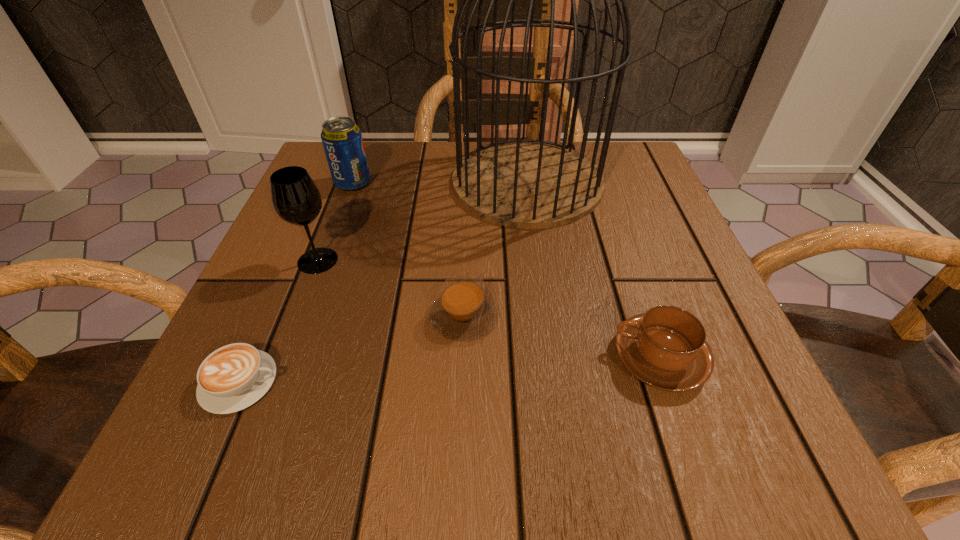
You are a GUI agent. You are given a task and a screenshot of the screen. Output one action in this format:
    pyautogui.click(x=<x>, y=<y>)
    Task: Click on the vacant space that's between the fourth shortest object and the birdcage
    The width and height of the screenshot is (960, 540).
    Given the screenshot: What is the action you would take?
    pyautogui.click(x=440, y=183)

Find the location of a particular element. vacant area that lies between the tallest object and the soda is located at coordinates (440, 183).

I want to click on empty space that is in between the soda and the leftmost cappuccino, so click(297, 282).

Locate an element on the screen. This screenshot has width=960, height=540. free point between the leftmost cappuccino and the soda is located at coordinates (297, 282).

You are a GUI agent. You are given a task and a screenshot of the screen. Output one action in this format:
    pyautogui.click(x=<x>, y=<y>)
    Task: Click on the empty location between the rightmost cappuccino and the second cappuccino from right to left
    The width and height of the screenshot is (960, 540).
    Given the screenshot: What is the action you would take?
    pyautogui.click(x=562, y=337)

Identify the location of free space between the fourth shortest object and the fifth tallest object. (408, 250).

Point out which object is positioned as the second nearest to the second tallest cappuccino. Please provide its 2D coordinates. Your answer should be formatted as a tuple, i.e. [(x, y)], where the tuple contains the x and y coordinates of a point satisfying the conditions above.

[(666, 348)]

What are the coordinates of `object that is the second closest to the rightmost cappuccino` in the screenshot? It's located at (523, 183).

Identify which cappuccino is located as the nearest to the second tallest cappuccino. Please provide its 2D coordinates. Your answer should be formatted as a tuple, i.e. [(x, y)], where the tuple contains the x and y coordinates of a point satisfying the conditions above.

[(666, 348)]

Select which cappuccino is the second closest to the shortest object. Please provide its 2D coordinates. Your answer should be formatted as a tuple, i.e. [(x, y)], where the tuple contains the x and y coordinates of a point satisfying the conditions above.

[(666, 348)]